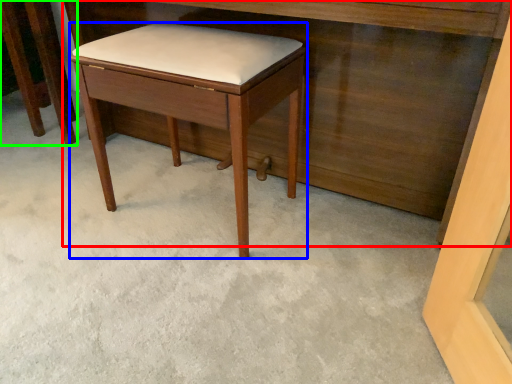
Question: Which object is the closest to the vanity (highlighted by a red box)? Choose among these: stool (highlighted by a blue box) or furniture (highlighted by a green box).

Choices:
 (A) stool
 (B) furniture

Answer: (A)